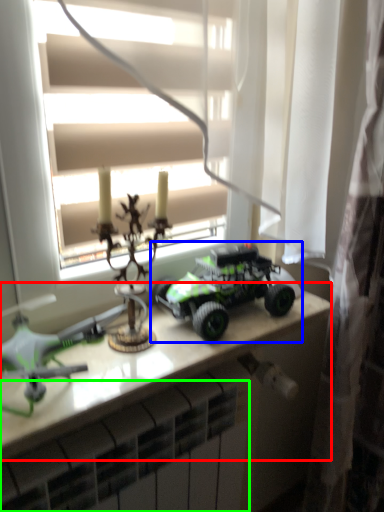
Question: Which object is positioned farthest from table (highlighted by a red box)? Select from toy (highlighted by a blue box) and radiator (highlighted by a green box).

Choices:
 (A) toy
 (B) radiator

Answer: (B)